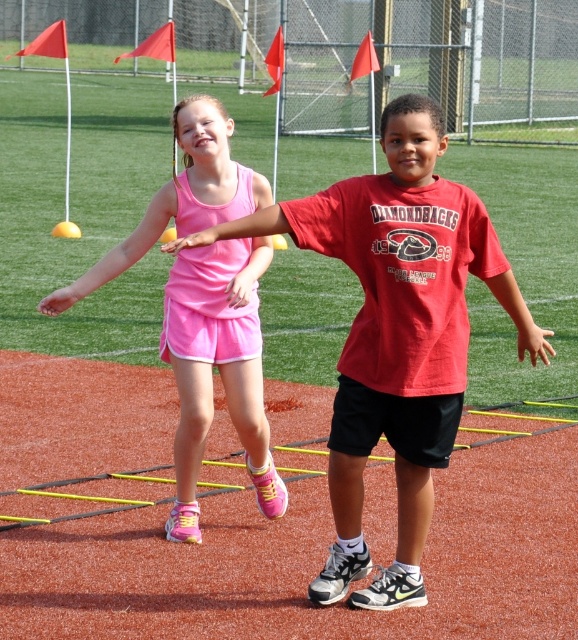
Question: Which of the following is the closest to the observer?

Choices:
 (A) red matte shirt at center
 (B) matte pink tank top at center

Answer: (A)

Question: Can you confirm if red matte shirt at center is positioned to the left of matte pink tank top at center?

Choices:
 (A) no
 (B) yes

Answer: (A)

Question: Is red matte shirt at center to the left of matte pink tank top at center from the viewer's perspective?

Choices:
 (A) no
 (B) yes

Answer: (A)

Question: Where is red matte shirt at center located in relation to matte pink tank top at center in the image?

Choices:
 (A) above
 (B) below

Answer: (B)